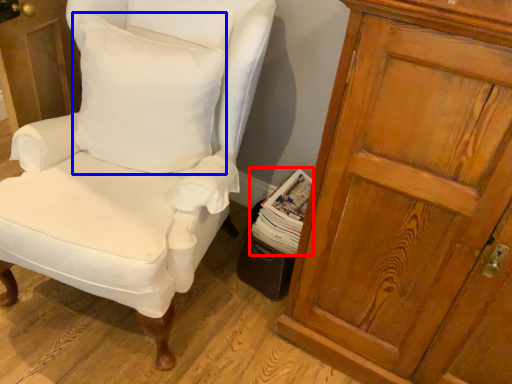
Question: Which object is closer to the camera taking this photo, magazine (highlighted by a red box) or pillow (highlighted by a blue box)?

Choices:
 (A) magazine
 (B) pillow

Answer: (B)